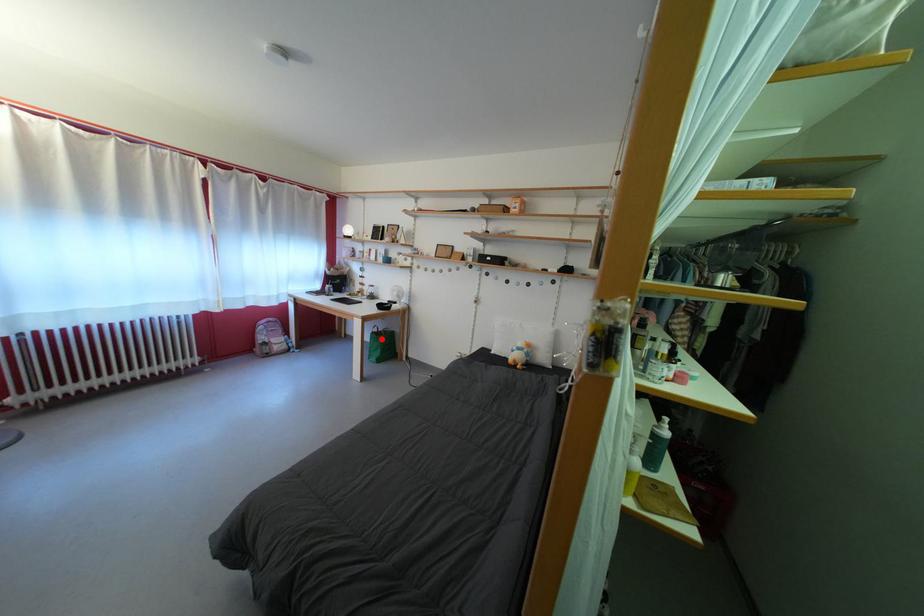
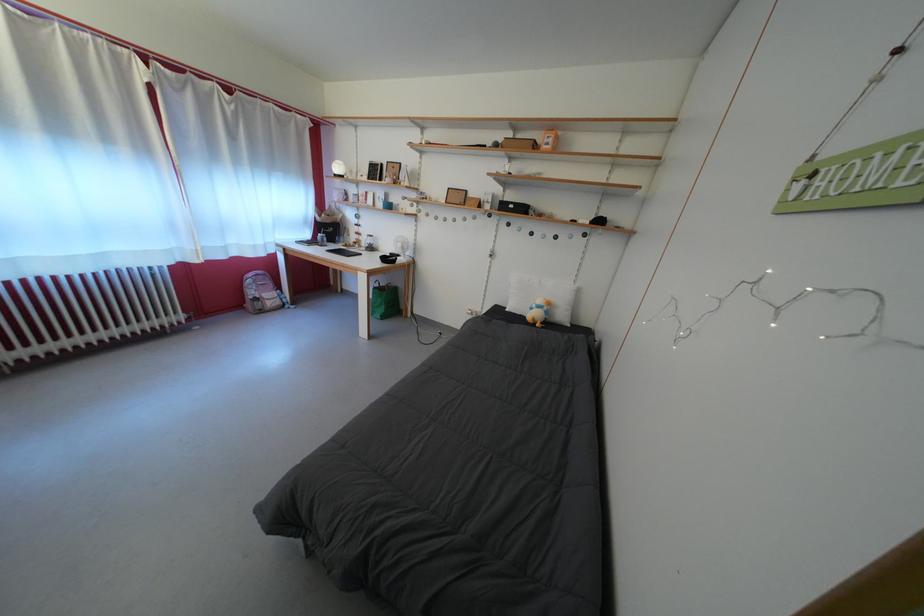
The point at the highlighted location is marked in the first image. Where is the corresponding point in the second image?

(383, 294)